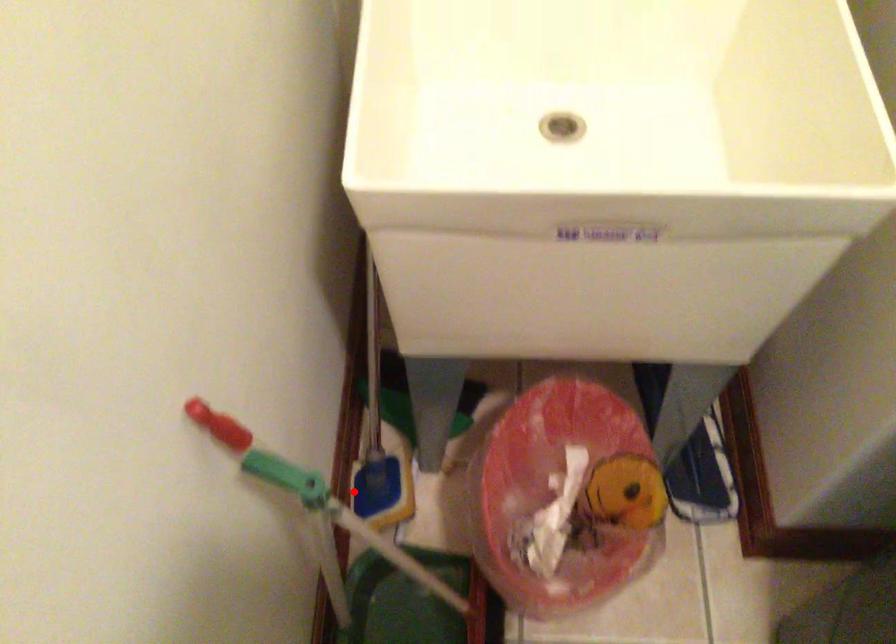
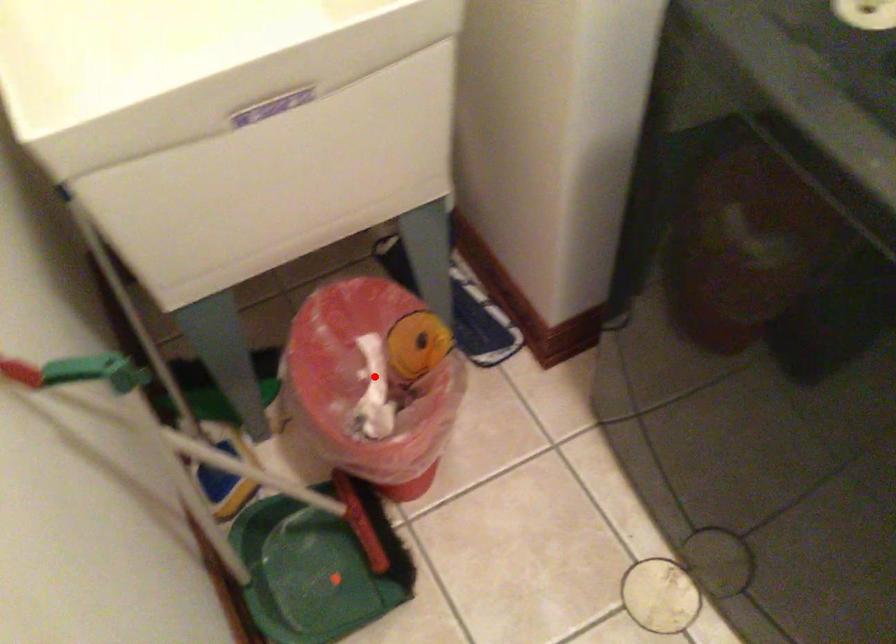
I am providing you with two images of the same scene from different viewpoints. A red point is marked on the first image and another point is marked on the second image. Are the points marked in image1 and image2 representing the same 3D position?

No